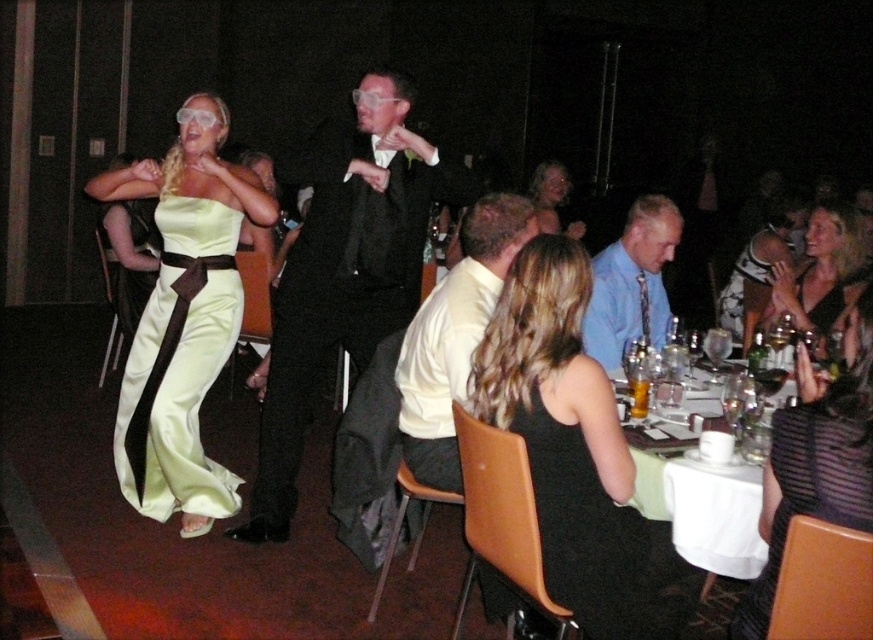
Between blue shirt at center and black satin dress at upper right, which one appears on the left side from the viewer's perspective?

blue shirt at center

Can you confirm if blue shirt at center is thinner than black satin dress at upper right?

Indeed, blue shirt at center has a lesser width compared to black satin dress at upper right.

Measure the distance between point (605, 257) and camera.

The distance of point (605, 257) from camera is 11.09 feet.

This screenshot has height=640, width=873. I want to click on blue shirt at center, so click(x=631, y=282).

Is point (528, 458) farther from camera compared to point (590, 317)?

That is False.

Does black satin dress at center appear over blue shirt at center?

No, black satin dress at center is not above blue shirt at center.

You are a GUI agent. You are given a task and a screenshot of the screen. Output one action in this format:
    pyautogui.click(x=<x>, y=<y>)
    Task: Click on the black satin dress at center
    
    Given the screenshot: What is the action you would take?
    pyautogui.click(x=575, y=452)

Does black satin suit at center have a smaller size compared to blue shirt at center?

No, black satin suit at center is not smaller than blue shirt at center.

Does black satin suit at center have a lesser width compared to blue shirt at center?

Incorrect, black satin suit at center's width is not less than blue shirt at center's.

Is point (388, 285) farther from viewer compared to point (605, 317)?

No, it is not.

Image resolution: width=873 pixels, height=640 pixels. I want to click on black satin suit at center, so click(x=345, y=273).